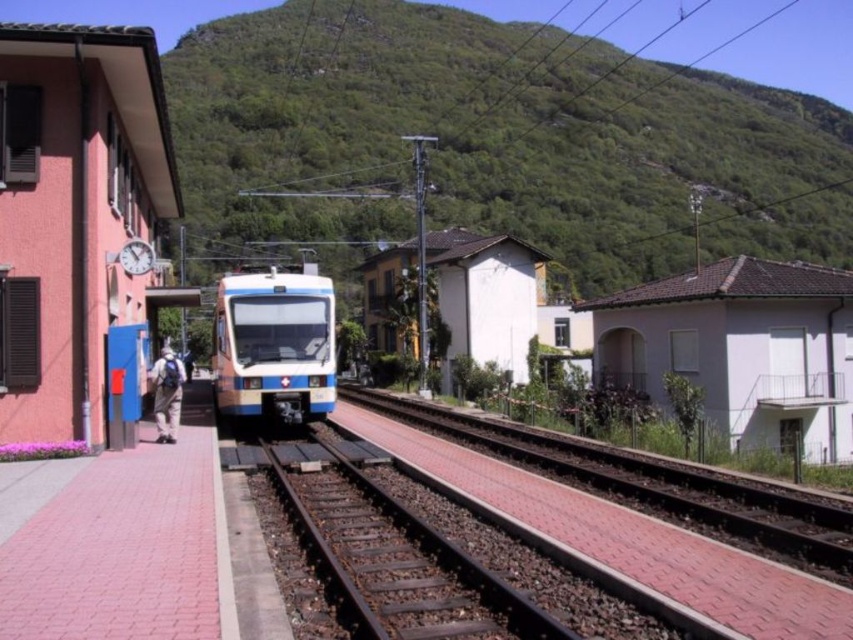
Question: Which point appears closest to the camera in this image?

Choices:
 (A) click(x=213, y=360)
 (B) click(x=379, y=100)
 (C) click(x=173, y=396)
 (D) click(x=799, y=557)

Answer: (D)

Question: Which point is closer to the camera?

Choices:
 (A) (540, 80)
 (B) (216, 394)
 (C) (155, 396)

Answer: (C)

Question: Does smooth concrete track at center appear on the left side of blue glossy train at center?

Choices:
 (A) no
 (B) yes

Answer: (A)

Question: Is smooth concrete track at center to the left of khaki pants at left from the viewer's perspective?

Choices:
 (A) no
 (B) yes

Answer: (A)

Question: Which is nearer to the smooth concrete track at center?

Choices:
 (A) khaki pants at left
 (B) blue glossy train at center
 (C) green leafy hillside at upper center

Answer: (B)

Question: Can you confirm if green leafy hillside at upper center is smaller than khaki pants at left?

Choices:
 (A) no
 (B) yes

Answer: (A)